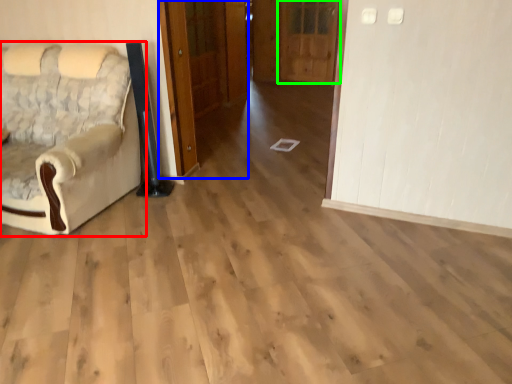
Question: Which object is positioned closest to chair (highlighted by a red box)? Select from door (highlighted by a blue box) and door (highlighted by a green box).

Choices:
 (A) door
 (B) door

Answer: (A)